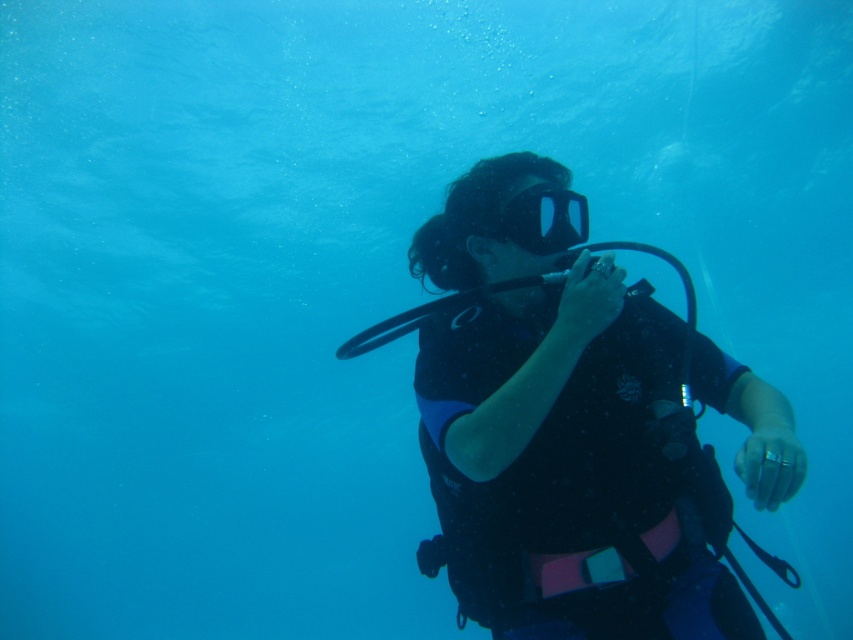
Question: Can you confirm if black matte scuba diver at center is positioned below transparent rubber mask at center?

Choices:
 (A) no
 (B) yes

Answer: (B)

Question: Is black matte scuba diver at center bigger than transparent rubber mask at center?

Choices:
 (A) yes
 (B) no

Answer: (A)

Question: Which of the following is the closest to the observer?

Choices:
 (A) (566, 230)
 (B) (506, 372)

Answer: (B)

Question: Which of the following is the closest to the observer?

Choices:
 (A) (543, 248)
 (B) (434, 381)

Answer: (B)

Question: In this image, where is black matte scuba diver at center located relative to transparent rubber mask at center?

Choices:
 (A) left
 (B) right

Answer: (B)

Question: Which object appears closest to the camera in this image?

Choices:
 (A) transparent rubber mask at center
 (B) black matte scuba diver at center

Answer: (B)